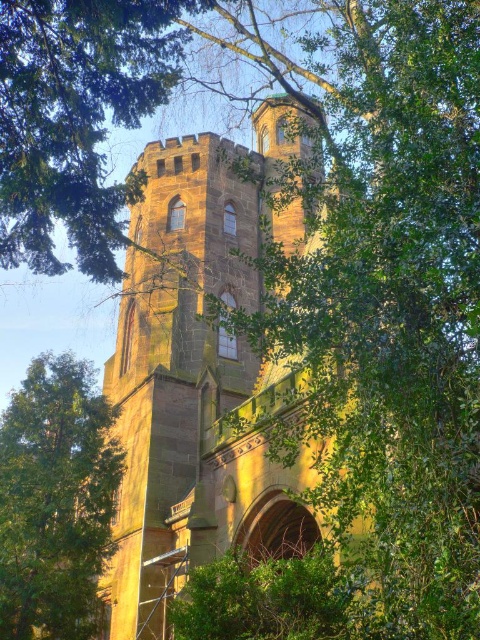
Is brown stone church at center taller than green leafy tree at center?

Indeed, brown stone church at center has a greater height compared to green leafy tree at center.

Which is more to the left, brown stone church at center or green leafy tree at center?

green leafy tree at center

Between point (252, 433) and point (110, 458), which one is positioned in front?

Point (252, 433)

You are a GUI agent. You are given a task and a screenshot of the screen. Output one action in this format:
    pyautogui.click(x=<x>, y=<y>)
    Task: Click on the brown stone church at center
    The image size is (480, 640).
    Given the screenshot: What is the action you would take?
    pyautogui.click(x=202, y=369)